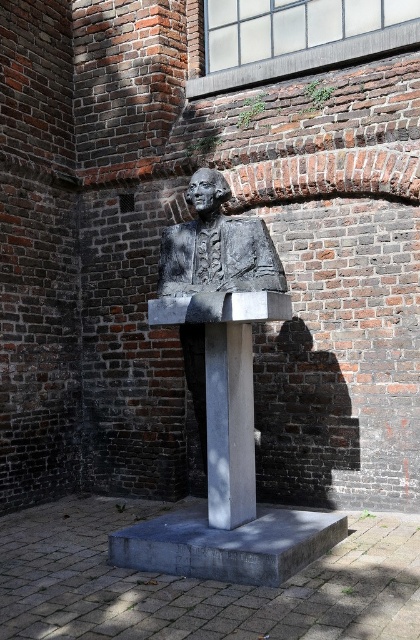
Question: Which object appears farthest from the camera in this image?

Choices:
 (A) bronze statue at center
 (B) bronze bust at center

Answer: (A)

Question: Does bronze bust at center have a smaller size compared to bronze statue at center?

Choices:
 (A) no
 (B) yes

Answer: (A)

Question: Does bronze bust at center come in front of bronze statue at center?

Choices:
 (A) no
 (B) yes

Answer: (B)

Question: Considering the relative positions of bronze bust at center and bronze statue at center in the image provided, where is bronze bust at center located with respect to bronze statue at center?

Choices:
 (A) left
 (B) right

Answer: (B)

Question: Which object appears farthest from the camera in this image?

Choices:
 (A) bronze bust at center
 (B) bronze statue at center

Answer: (B)